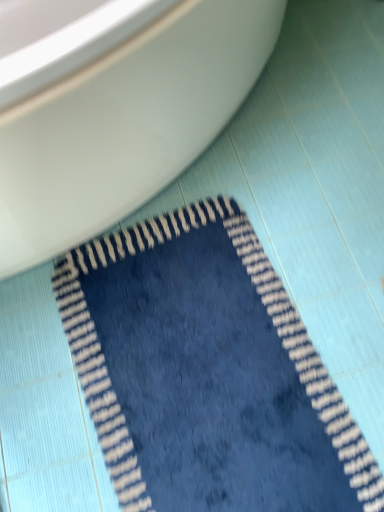
Identify the location of free space behind navy blue plush rug at lower center. (285, 169).